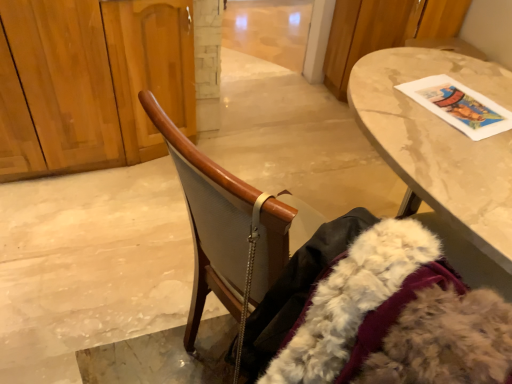
This screenshot has height=384, width=512. In order to click on vacant area that lies in front of wooden dresser at left in this screenshot , I will do `click(94, 243)`.